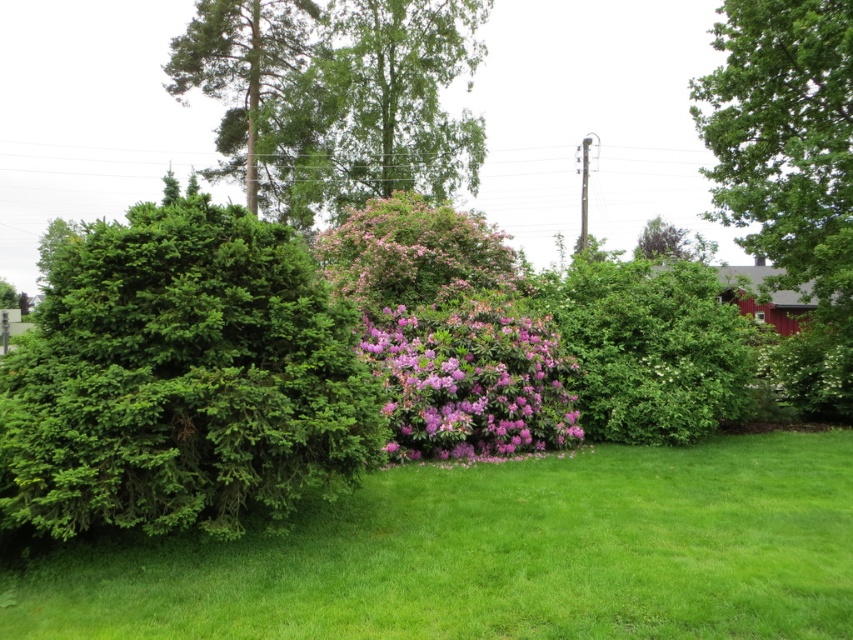
Question: Observing the image, what is the correct spatial positioning of green leafy hedge at center in reference to green textured tree at upper left?

Choices:
 (A) below
 (B) above

Answer: (A)

Question: Which point is closer to the camera taking this photo?

Choices:
 (A) (469, 424)
 (B) (778, 163)
 (C) (299, 40)

Answer: (A)

Question: Which of the following is the farthest from the observer?

Choices:
 (A) green textured tree at upper left
 (B) pink matte bush at center
 (C) green leafy tree at upper right

Answer: (A)

Question: Does green leafy tree at upper right appear on the left side of green textured tree at upper left?

Choices:
 (A) no
 (B) yes

Answer: (A)

Question: Does green leafy hedge at center appear on the left side of pink matte bush at center?

Choices:
 (A) no
 (B) yes

Answer: (A)

Question: Considering the real-world distances, which object is farthest from the green leafy tree at upper right?

Choices:
 (A) pink matte bush at center
 (B) green leafy hedge at center

Answer: (A)